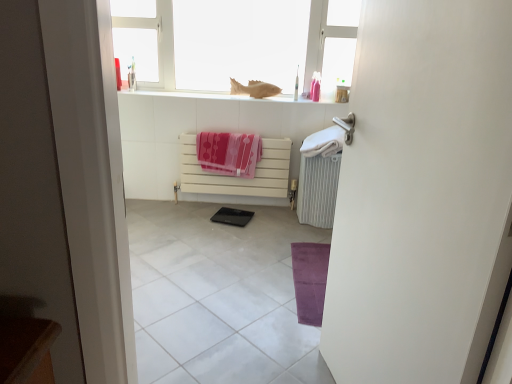
Identify the location of vacant space underneath white matte radiator at center (from a real-world perspective). The width and height of the screenshot is (512, 384). (227, 200).